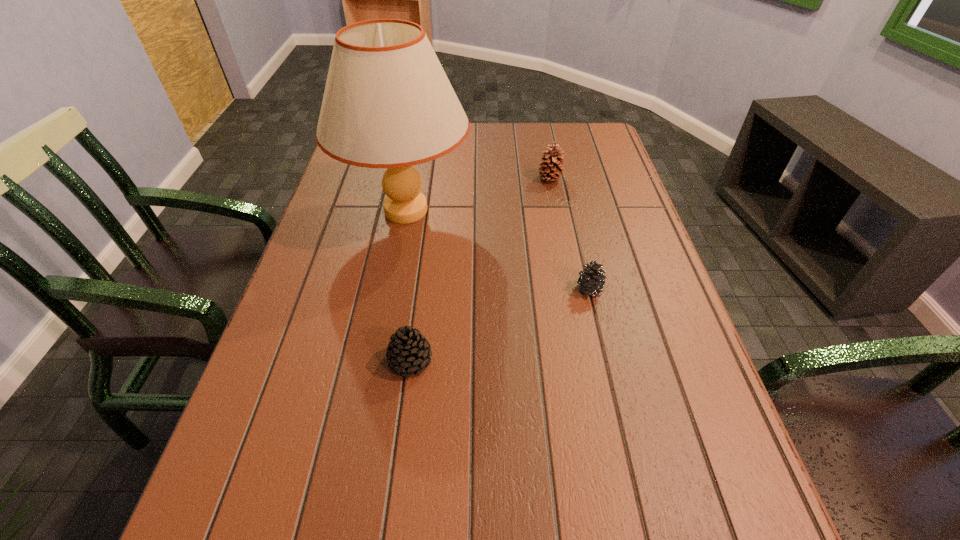
This screenshot has width=960, height=540. Find the location of `vacant space situated on the back of the shortest object`. vacant space situated on the back of the shortest object is located at coordinates (576, 231).

Locate an element on the screen. This screenshot has height=540, width=960. object that is at the left edge is located at coordinates coord(388,103).

At what (x,y) coordinates should I click in order to perform the action: click on object at the right edge. Please return your answer as a coordinate pair (x, y). Looking at the image, I should click on (591, 280).

Image resolution: width=960 pixels, height=540 pixels. Find the location of `free region at the far edge`. free region at the far edge is located at coordinates (503, 136).

In order to click on vacant space at the left edge of the desktop in this screenshot , I will do `click(287, 487)`.

Where is `vacant space at the right edge`? The image size is (960, 540). vacant space at the right edge is located at coordinates (706, 411).

Identify the location of vacant area that lies between the leftmost pinecone and the farthest pinecone. The height and width of the screenshot is (540, 960). (480, 270).

Identify the location of vacant area between the shortest object and the lampshade. This screenshot has width=960, height=540. (497, 250).

Locate an element on the screen. free space between the second nearest object and the tallest object is located at coordinates (497, 250).

Locate an element on the screen. The height and width of the screenshot is (540, 960). free area in between the shortest pinecone and the lampshade is located at coordinates (x=497, y=250).